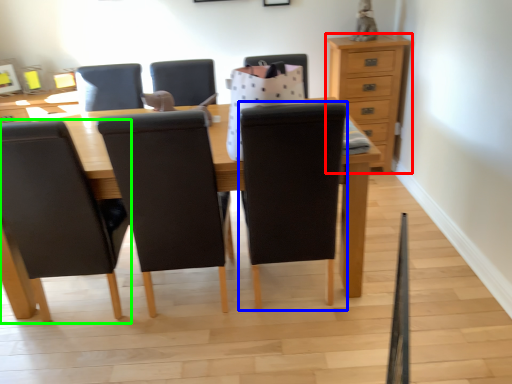
Question: Which object is the closest to the chest of drawers (highlighted by a red box)? Choose among these: chair (highlighted by a blue box) or chair (highlighted by a green box).

Choices:
 (A) chair
 (B) chair

Answer: (A)